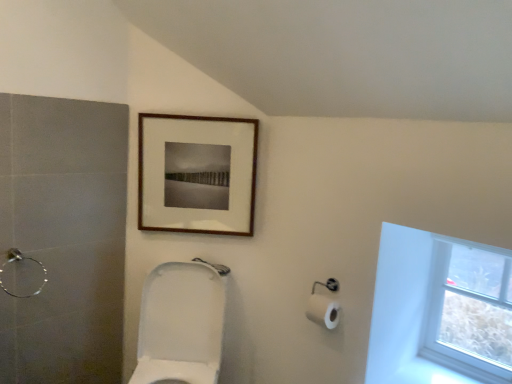
What do you see at coordinates (440, 308) in the screenshot? I see `transparent glass window at upper right` at bounding box center [440, 308].

Locate an element on the screen. The width and height of the screenshot is (512, 384). brushed metal shower at left is located at coordinates (21, 261).

What do you see at coordinates (21, 261) in the screenshot? The height and width of the screenshot is (384, 512). I see `brushed metal shower at left` at bounding box center [21, 261].

What do you see at coordinates (181, 324) in the screenshot?
I see `white glossy toilet at center` at bounding box center [181, 324].

Find the location of a particular element. The image size is (512, 384). white glossy toilet at center is located at coordinates (181, 324).

Find the location of a particular element. This screenshot has width=512, height=384. wooden picture frame at upper center is located at coordinates point(197,174).

You are a GUI agent. You are given a task and a screenshot of the screen. Output one action in this format:
    pyautogui.click(x=<x>, y=<y>)
    Task: Click on the transparent glass window at upper right
    This screenshot has width=512, height=384.
    Given the screenshot: What is the action you would take?
    pyautogui.click(x=440, y=308)

Is white glossy toilet at center positioned with its back to transparent glass window at upper right?

white glossy toilet at center does not have its back to transparent glass window at upper right.

Considering the relative sizes of white glossy toilet at center and transparent glass window at upper right in the image provided, is white glossy toilet at center bigger than transparent glass window at upper right?

Yes, white glossy toilet at center is bigger than transparent glass window at upper right.

Is white glossy toilet at center taller or shorter than transparent glass window at upper right?

white glossy toilet at center is taller than transparent glass window at upper right.

Considering the points (148, 277) and (483, 362), which point is behind, point (148, 277) or point (483, 362)?

The point (148, 277) is more distant.

Considering the positions of objects brushed metal shower at left and wooden picture frame at upper center in the image provided, who is more to the right, brushed metal shower at left or wooden picture frame at upper center?

Positioned to the right is wooden picture frame at upper center.

How much distance is there between brushed metal shower at left and wooden picture frame at upper center?

A: brushed metal shower at left is 28.28 inches away from wooden picture frame at upper center.

I want to click on shower in front of the wooden picture frame at upper center, so click(x=21, y=261).

At what (x,y) coordinates should I click in order to perform the action: click on picture frame lying behind the transparent glass window at upper right. Please return your answer as a coordinate pair (x, y). This screenshot has width=512, height=384. Looking at the image, I should click on (197, 174).

How different are the orientations of wooden picture frame at upper center and transparent glass window at upper right in degrees?

The angle between the facing direction of wooden picture frame at upper center and the facing direction of transparent glass window at upper right is 41.4 degrees.

Which of these two, wooden picture frame at upper center or transparent glass window at upper right, is smaller?

wooden picture frame at upper center is smaller.

Is wooden picture frame at upper center oriented towards transparent glass window at upper right?

No.

From the picture: Can you confirm if transparent glass window at upper right is bigger than brushed metal shower at left?

Yes.

Identify the location of window that is on the right side of brushed metal shower at left. (440, 308).

Which of these two, transparent glass window at upper right or brushed metal shower at left, is wider?

With larger width is transparent glass window at upper right.

Is brushed metal shower at left located within transparent glass window at upper right?

That's incorrect, brushed metal shower at left is not inside transparent glass window at upper right.

Considering the relative sizes of wooden picture frame at upper center and white glossy toilet at center in the image provided, is wooden picture frame at upper center wider than white glossy toilet at center?

In fact, wooden picture frame at upper center might be narrower than white glossy toilet at center.

From a real-world perspective, is wooden picture frame at upper center located higher than white glossy toilet at center?

Indeed, from a real-world perspective, wooden picture frame at upper center stands above white glossy toilet at center.

Considering the sizes of objects wooden picture frame at upper center and white glossy toilet at center in the image provided, who is smaller, wooden picture frame at upper center or white glossy toilet at center?

With smaller size is wooden picture frame at upper center.

Is wooden picture frame at upper center placed right next to white glossy toilet at center?

They are not placed beside each other.

In the scene shown: Is brushed metal shower at left shorter than transparent glass window at upper right?

Indeed, brushed metal shower at left has a lesser height compared to transparent glass window at upper right.

The height and width of the screenshot is (384, 512). I want to click on window below the brushed metal shower at left (from the image's perspective), so click(x=440, y=308).

Relative to transparent glass window at upper right, is brushed metal shower at left in front or behind?

brushed metal shower at left is in front of transparent glass window at upper right.

Is point (1, 284) closer or farther from the camera than point (447, 293)?

Point (1, 284) appears to be closer to the viewer than point (447, 293).

Between point (8, 250) and point (192, 313), which one is positioned in front?

Point (8, 250)

You are a GUI agent. You are given a task and a screenshot of the screen. Output one action in this format:
    pyautogui.click(x=<x>, y=<y>)
    Task: Click on the shower behind the white glossy toilet at center
    This screenshot has height=384, width=512.
    Given the screenshot: What is the action you would take?
    pyautogui.click(x=21, y=261)

From the image's perspective, between brushed metal shower at left and white glossy toilet at center, which one is located above?

brushed metal shower at left.

What are the coordinates of `window above the white glossy toilet at center (from a real-world perspective)` in the screenshot? It's located at (440, 308).

Where is `picture frame that is above the brushed metal shower at left (from the image's perspective)`? picture frame that is above the brushed metal shower at left (from the image's perspective) is located at coordinates (197, 174).

Looking at the image, which one is located closer to wooden picture frame at upper center, white glossy toilet at center or transparent glass window at upper right?

white glossy toilet at center is positioned closer to the anchor wooden picture frame at upper center.

From the image, which object appears to be farther from brushed metal shower at left, white glossy toilet at center or transparent glass window at upper right?

Based on the image, transparent glass window at upper right appears to be further to brushed metal shower at left.

From the image, which object appears to be farther from brushed metal shower at left, transparent glass window at upper right or white glossy toilet at center?

transparent glass window at upper right is further to brushed metal shower at left.

Based on their spatial positions, is white glossy toilet at center or wooden picture frame at upper center further from transparent glass window at upper right?

The object further to transparent glass window at upper right is white glossy toilet at center.

From the image, which object appears to be farther from transparent glass window at upper right, wooden picture frame at upper center or white glossy toilet at center?

The object further to transparent glass window at upper right is white glossy toilet at center.

Based on their spatial positions, is wooden picture frame at upper center or brushed metal shower at left further from white glossy toilet at center?

brushed metal shower at left is positioned further to the anchor white glossy toilet at center.

Looking at the image, which one is located further to white glossy toilet at center, transparent glass window at upper right or wooden picture frame at upper center?

The object further to white glossy toilet at center is transparent glass window at upper right.

When comparing their distances from wooden picture frame at upper center, does brushed metal shower at left or transparent glass window at upper right seem closer?

brushed metal shower at left.

The image size is (512, 384). In order to click on picture frame between white glossy toilet at center and transparent glass window at upper right in this screenshot , I will do `click(197, 174)`.

I want to click on picture frame between brushed metal shower at left and transparent glass window at upper right, so click(x=197, y=174).

I want to click on toilet located between brushed metal shower at left and transparent glass window at upper right in the left-right direction, so click(x=181, y=324).

Where is `shower between wooden picture frame at upper center and white glossy toilet at center from top to bottom`? The width and height of the screenshot is (512, 384). shower between wooden picture frame at upper center and white glossy toilet at center from top to bottom is located at coordinates (21, 261).